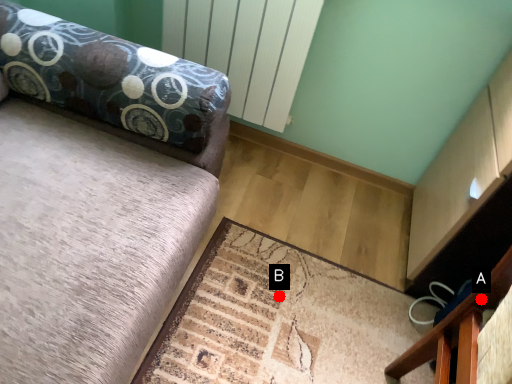
Question: Two points are circled on the image, labeled by A and B beside each circle. Which point appears farthest from the camera in this image?

Choices:
 (A) A is further
 (B) B is further

Answer: (B)